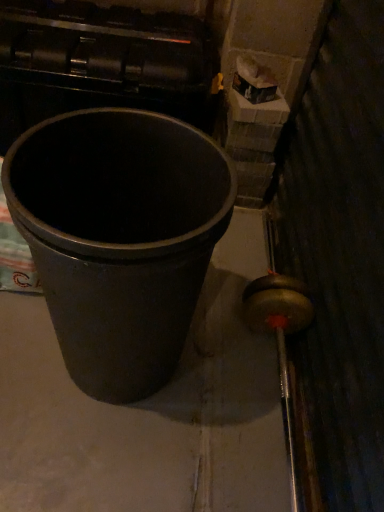
Image resolution: width=384 pixels, height=512 pixels. I want to click on vacant space to the right of matte black trash can at center-left, so click(236, 387).